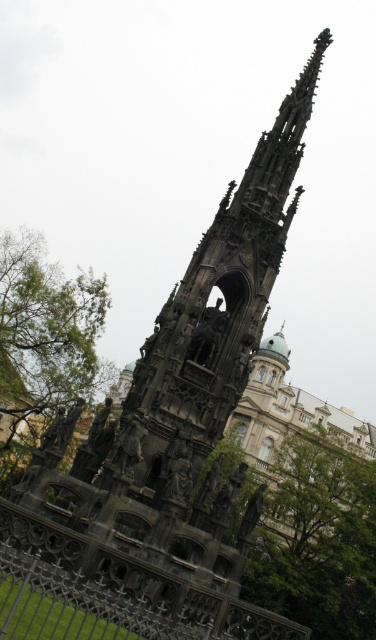
Where is `green leafy tree at left`? Image resolution: width=376 pixels, height=640 pixels. green leafy tree at left is located at coordinates coord(42,342).

Is green leafy tree at left to the right of black wrought iron fence at lower left from the viewer's perspective?

No, green leafy tree at left is not to the right of black wrought iron fence at lower left.

You are a GUI agent. You are given a task and a screenshot of the screen. Output one action in this format:
    pyautogui.click(x=<x>, y=<y>)
    Task: Click on the green leafy tree at left
    This screenshot has width=376, height=640.
    Given the screenshot: What is the action you would take?
    pyautogui.click(x=42, y=342)

The height and width of the screenshot is (640, 376). Find the location of `green leafy tree at left`. green leafy tree at left is located at coordinates (42, 342).

Who is shorter, green leafy tree at center or green leafy tree at left?

With less height is green leafy tree at center.

Does green leafy tree at center have a larger size compared to green leafy tree at left?

No, green leafy tree at center is not bigger than green leafy tree at left.

Image resolution: width=376 pixels, height=640 pixels. I want to click on green leafy tree at center, so click(318, 538).

Does green leafy tree at center appear on the right side of black wrought iron fence at lower left?

Correct, you'll find green leafy tree at center to the right of black wrought iron fence at lower left.

This screenshot has width=376, height=640. I want to click on green leafy tree at center, so click(318, 538).

Which is behind, point (277, 552) or point (166, 636)?

Point (277, 552)

The height and width of the screenshot is (640, 376). What are the coordinates of `green leafy tree at center` in the screenshot? It's located at (318, 538).